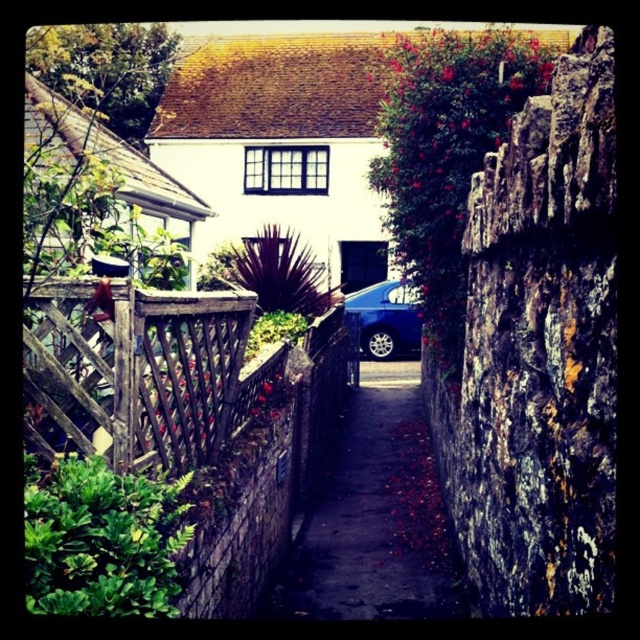
Is point (86, 374) closer to camera compared to point (218, 371)?

Yes, point (86, 374) is closer to viewer.

Which is above, weathered wood fence at left or wooden lattice fence at center-left?

Positioned higher is wooden lattice fence at center-left.

Does point (58, 417) come behind point (65, 320)?

Yes, it is.

Identify the location of weathered wood fence at left. (189, 416).

Who is shorter, white matte cottage at center or dark concrete driveway at center?

Standing shorter between the two is dark concrete driveway at center.

Looking at this image, is white matte cottage at center thinner than dark concrete driveway at center?

No.

The height and width of the screenshot is (640, 640). What do you see at coordinates (282, 141) in the screenshot?
I see `white matte cottage at center` at bounding box center [282, 141].

Where is `white matte cottage at center`? The image size is (640, 640). white matte cottage at center is located at coordinates (282, 141).

Who is more forward, (65,378) or (358,150)?

Positioned in front is point (65,378).

Can you confirm if weathered wood fence at left is positioned above white matte cottage at center?

No, weathered wood fence at left is not above white matte cottage at center.

Between point (188, 461) and point (192, 102), which one is positioned in front?

Positioned in front is point (188, 461).

Where is `weathered wood fence at left`? This screenshot has width=640, height=640. weathered wood fence at left is located at coordinates (189, 416).